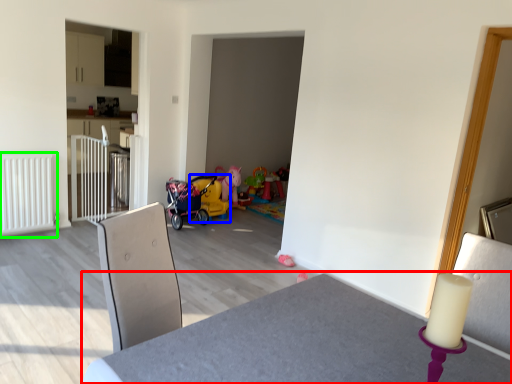
Question: Based on their relative distances, which object is farther from table (highlighted by a red box)? Choose from baby carriage (highlighted by a blue box) and radiator (highlighted by a green box).

Choices:
 (A) baby carriage
 (B) radiator

Answer: (A)